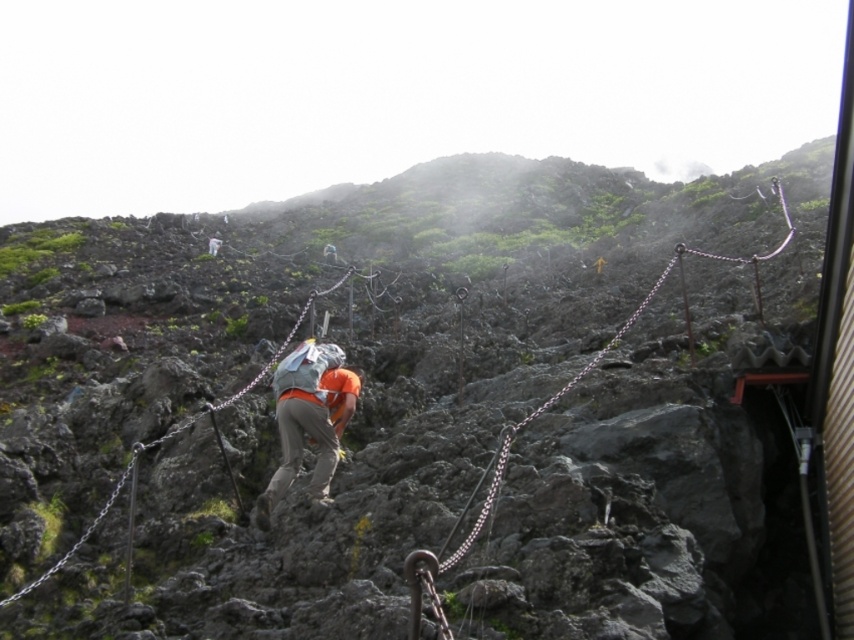
Looking at this image, you are a hiker who wants to secure your gear. You have an orange fabric backpack at center and a rusty chain at upper center. Which item can you use to hang your gear higher?

The rusty chain at upper center is taller than the orange fabric backpack at center, so you can hang your gear higher on the rusty chain at upper center.

You are a hiker trying to navigate the rocky terrain. You notice an orange fabric backpack at center and a metallic chain at center. Which object takes up more space in the image?

The metallic chain at center occupies more space than the orange fabric backpack at center.